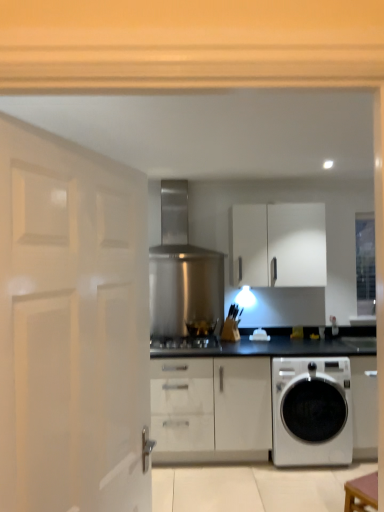
Question: Is point (163, 344) closer or farther from the camera than point (31, 254)?

Choices:
 (A) farther
 (B) closer

Answer: (A)

Question: Considering their positions, is satin silver gas stove at center located in front of or behind white glossy door at left?

Choices:
 (A) front
 (B) behind

Answer: (B)

Question: Which is nearer to the stainless steel exhaust hood at center?

Choices:
 (A) brown wooden table at lower right
 (B) black glass stove at center
 (C) white glossy washing machine at lower right
 (D) transparent glass door at upper right
 (E) satin silver gas stove at center

Answer: (B)

Question: Based on their relative distances, which object is nearer to the black glass stove at center?

Choices:
 (A) white glossy washing machine at lower right
 (B) brown wooden table at lower right
 (C) white matte cabinet at upper center
 (D) stainless steel exhaust hood at center
 (E) satin silver gas stove at center

Answer: (E)